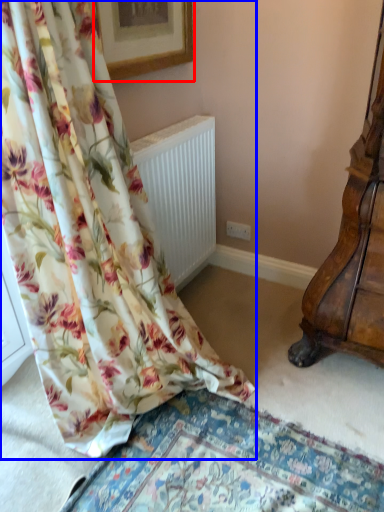
Question: Which point is closer to the camera, picture frame (highlighted by a red box) or curtain (highlighted by a blue box)?

Choices:
 (A) picture frame
 (B) curtain

Answer: (B)